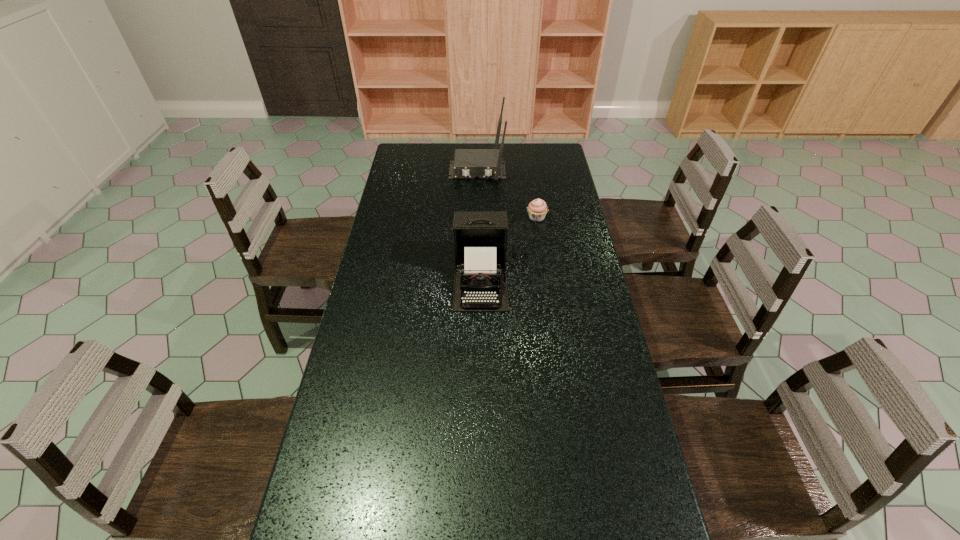
Image resolution: width=960 pixels, height=540 pixels. I want to click on router, so click(468, 163).

Find the location of a particular element. The height and width of the screenshot is (540, 960). the farthest object is located at coordinates (468, 163).

Where is `typewriter`? typewriter is located at coordinates (480, 237).

Locate an element on the screen. The image size is (960, 540). the second shortest object is located at coordinates (480, 237).

This screenshot has width=960, height=540. In order to click on the second farthest object in this screenshot , I will do `click(537, 209)`.

Where is `the rightmost object`? The image size is (960, 540). the rightmost object is located at coordinates [x=537, y=209].

Find the location of `vacant space located 0.080m on the back of the tallest object to connect cables`. vacant space located 0.080m on the back of the tallest object to connect cables is located at coordinates (477, 195).

The image size is (960, 540). I want to click on free spot located 0.110m inside the open case of the second shortest object, so (480, 341).

Find the location of `free spot located on the left of the second farthest object`. free spot located on the left of the second farthest object is located at coordinates (452, 218).

Where is `object positioned at the far edge`? This screenshot has height=540, width=960. object positioned at the far edge is located at coordinates (468, 163).